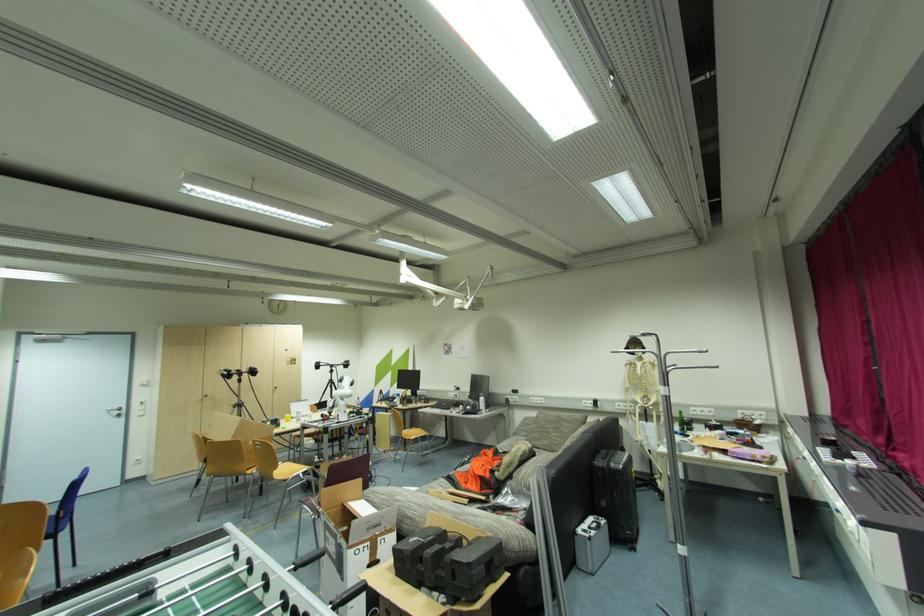
The height and width of the screenshot is (616, 924). Describe the element at coordinates (116, 411) in the screenshot. I see `the silver door handle` at that location.